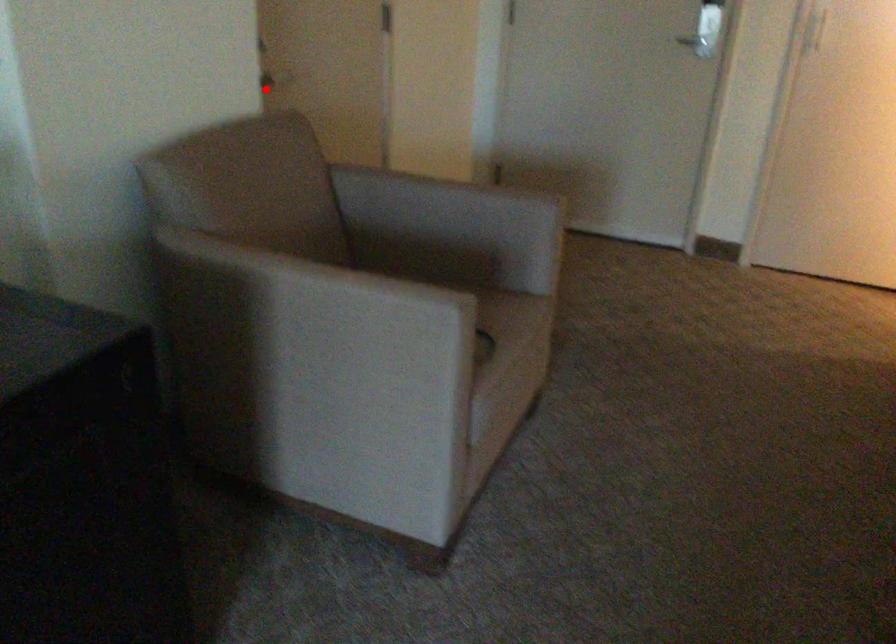
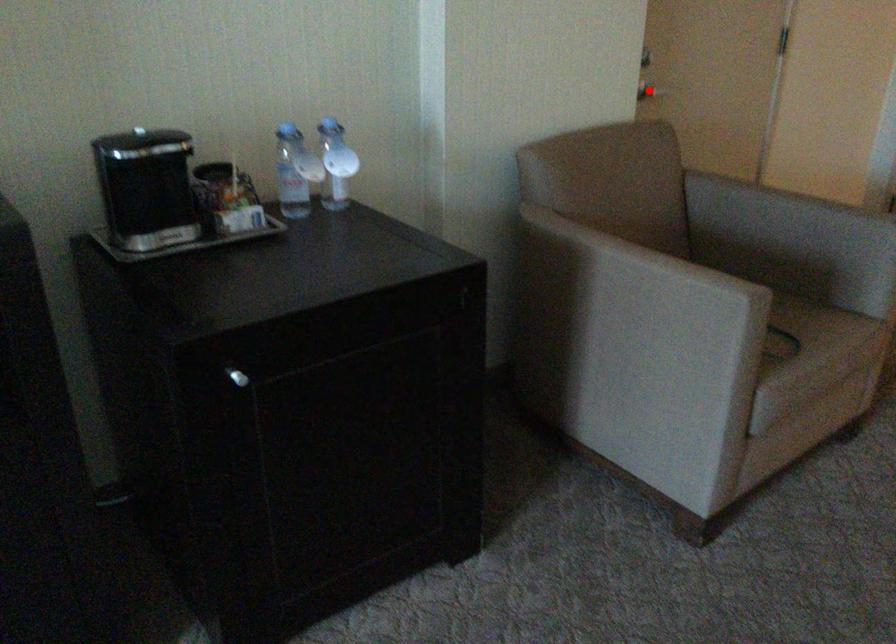
I am providing you with two images of the same scene from different viewpoints. A red point is marked on the first image and another point is marked on the second image. Is the marked point in image1 the same physical position as the marked point in image2?

Yes